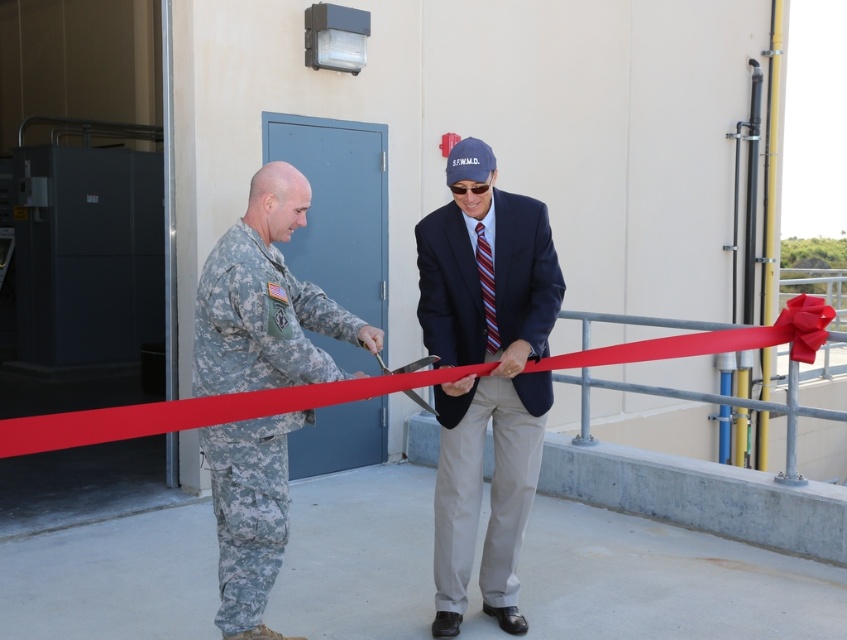
Which is above, dark blue suit at center or camouflage fabric uniform at center?

dark blue suit at center

Is dark blue suit at center thinner than camouflage fabric uniform at center?

Yes.

Does point (469, 516) come farther from viewer compared to point (235, 269)?

Yes, point (469, 516) is farther from viewer.

What are the coordinates of `dark blue suit at center` in the screenshot? It's located at (485, 376).

Can you confirm if dark blue suit at center is wider than red matte ribbon at center?

In fact, dark blue suit at center might be narrower than red matte ribbon at center.

In the scene shown: Which is below, dark blue suit at center or red matte ribbon at center?

dark blue suit at center is below.

What do you see at coordinates (485, 376) in the screenshot? This screenshot has width=847, height=640. I see `dark blue suit at center` at bounding box center [485, 376].

Find the location of a particular element. dark blue suit at center is located at coordinates (485, 376).

Does point (214, 360) lie behind point (612, 352)?

No, (214, 360) is in front of (612, 352).

Is camouflage fabric uniform at center positioned at the back of red matte ribbon at center?

No, camouflage fabric uniform at center is closer to the viewer.

This screenshot has height=640, width=847. What do you see at coordinates (266, 300) in the screenshot?
I see `camouflage fabric uniform at center` at bounding box center [266, 300].

Find the location of a particular element. camouflage fabric uniform at center is located at coordinates (266, 300).